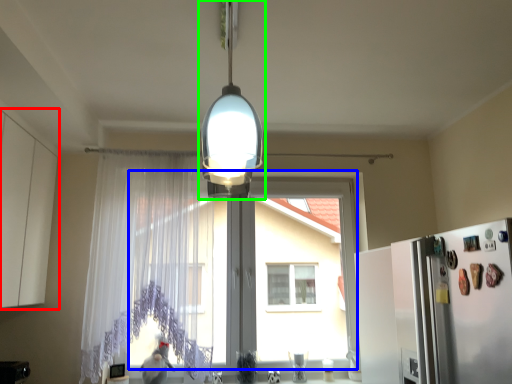
Question: Estimate the real-world distances between objects in this image. Which object is closer to cabinetry (highlighted by a red box), window screen (highlighted by a blue box) or lamp (highlighted by a green box)?

Choices:
 (A) window screen
 (B) lamp

Answer: (B)